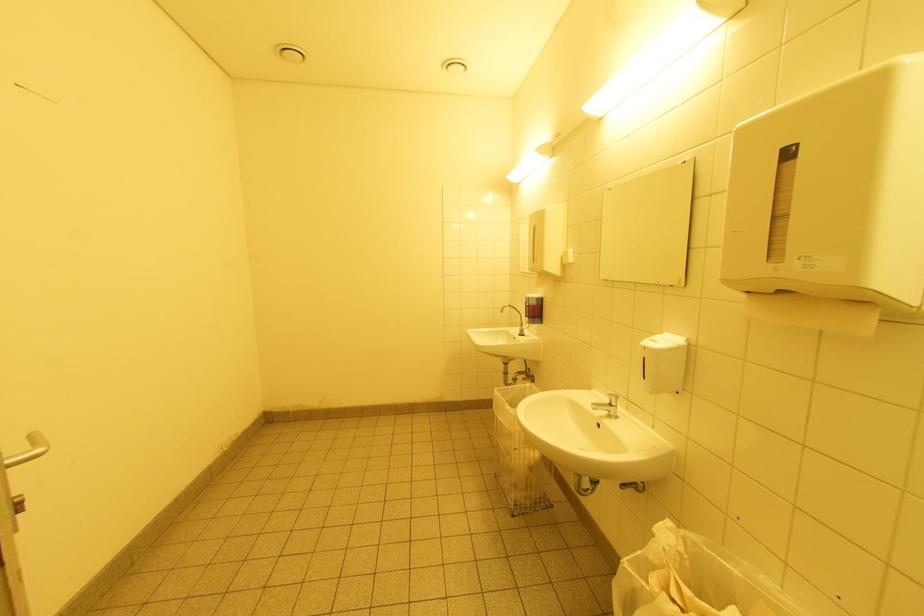
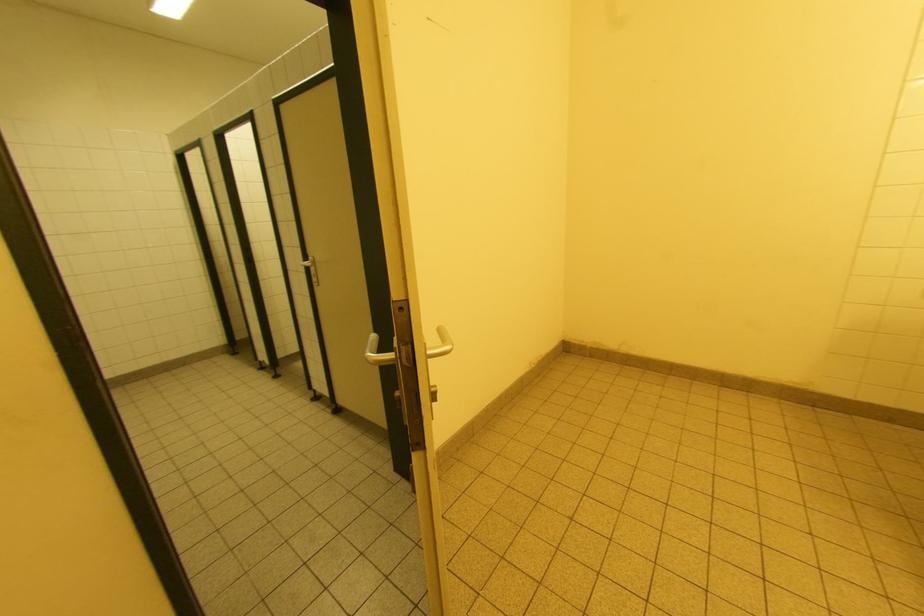
Question: The camera is either moving clockwise (left) or counter-clockwise (right) around the object. The first image is from the beginning of the video and the second image is from the end. Is the camera moving left or right when shooting the video?

Choices:
 (A) Left
 (B) Right

Answer: (B)